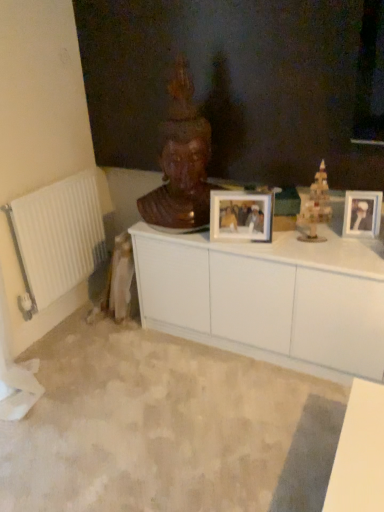
Where is `vacant region to the right of wooden tower at upper right`? vacant region to the right of wooden tower at upper right is located at coordinates (354, 244).